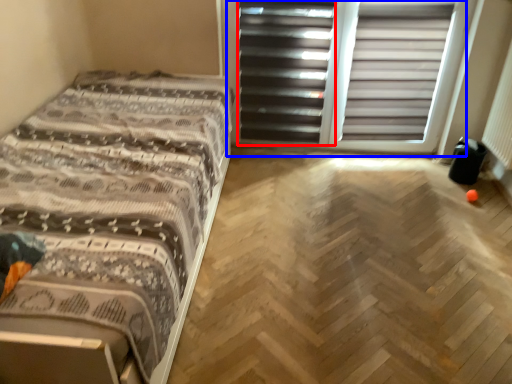
Question: Which of the following is the farthest to the observer, screen door (highlighted by a red box) or screen door (highlighted by a blue box)?

Choices:
 (A) screen door
 (B) screen door

Answer: (A)